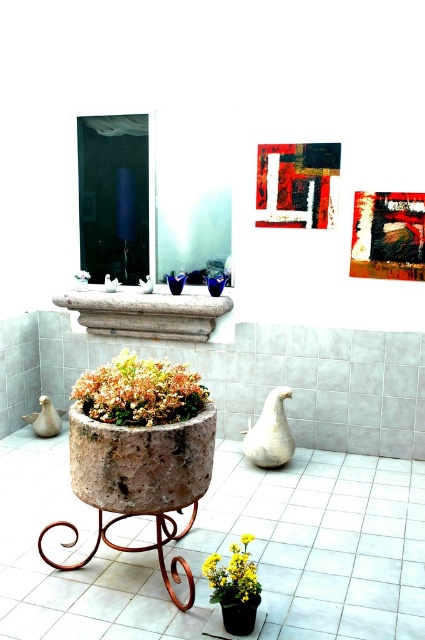
Is matte stone pot at center positioned at the back of matte black pot at lower center?

Yes.

Can you confirm if matte stone pot at center is positioned above matte black pot at lower center?

Yes.

Between point (155, 378) and point (243, 604), which one is positioned behind?

The point (155, 378) is behind.

Where is `matte stone pot at center`? This screenshot has width=425, height=640. matte stone pot at center is located at coordinates (139, 392).

Between yellow matte flower at lower center and matte black pot at lower center, which one has less height?

With less height is matte black pot at lower center.

Is yellow matte flower at lower center wider than matte black pot at lower center?

Yes, yellow matte flower at lower center is wider than matte black pot at lower center.

What do you see at coordinates (234, 577) in the screenshot? The image size is (425, 640). I see `yellow matte flower at lower center` at bounding box center [234, 577].

Locate an element on the screen. This screenshot has height=640, width=425. yellow matte flower at lower center is located at coordinates 234,577.

How distant is matte stone pot at center from yellow matte flower at lower center?

matte stone pot at center and yellow matte flower at lower center are 73.20 centimeters apart.

Is matte stone pot at center smaller than yellow matte flower at lower center?

No.

Where is `matte stone pot at center`? This screenshot has height=640, width=425. matte stone pot at center is located at coordinates (139, 392).

The height and width of the screenshot is (640, 425). Find the location of `matte stone pot at center`. matte stone pot at center is located at coordinates (139, 392).